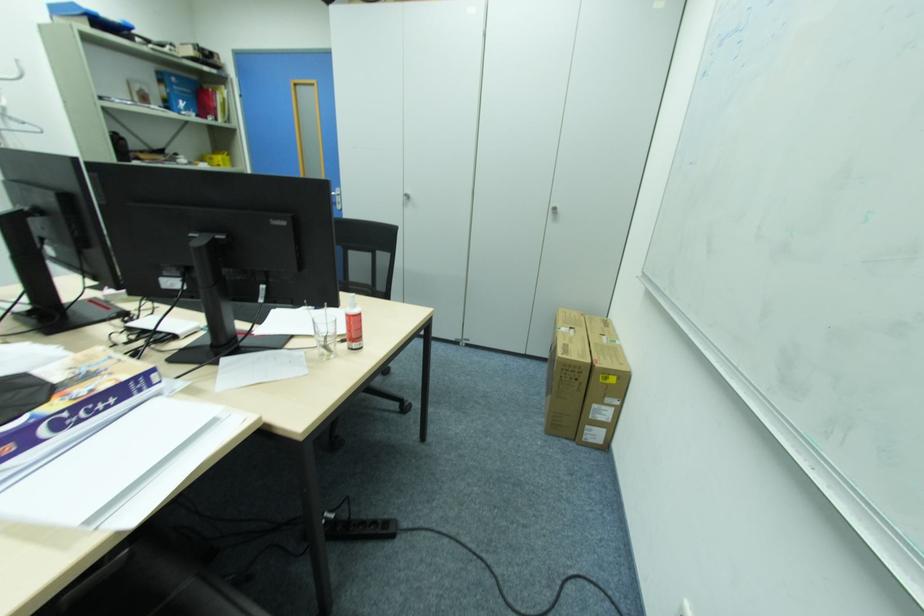
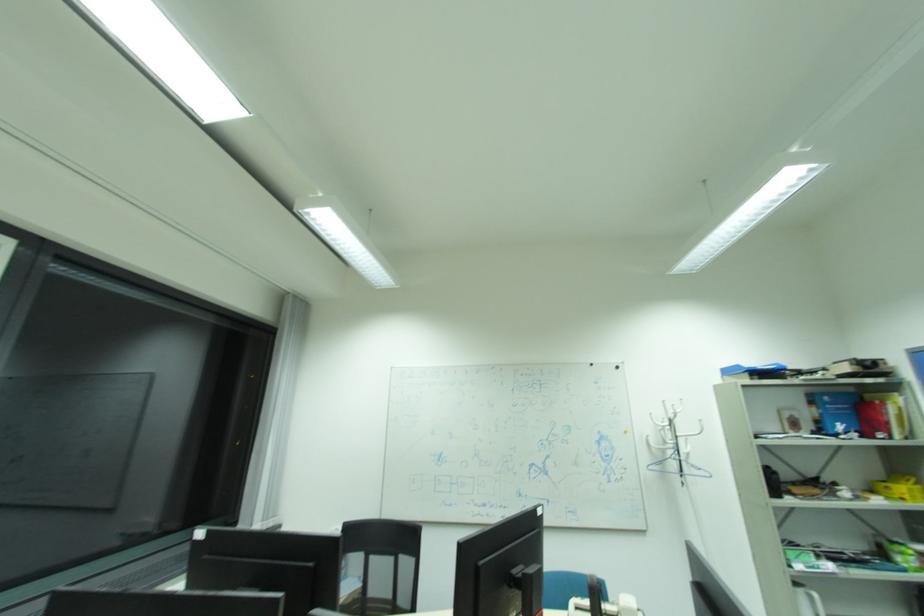
First-person continuous shooting, in which direction is the camera rotating?

The camera rotated toward left-up.